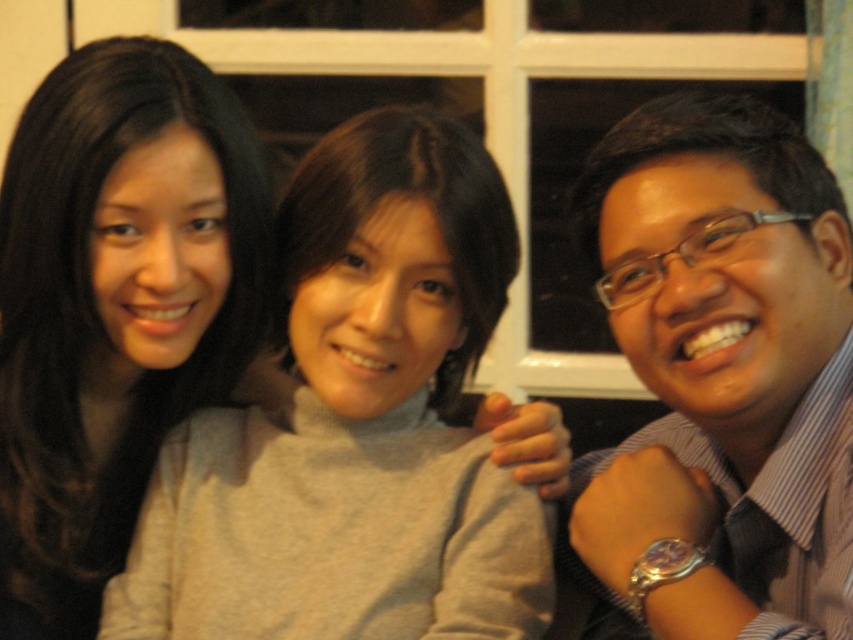
Between point (457, 176) and point (683, 413), which one is positioned in front?

Point (683, 413)

Can you confirm if gray matte sweater at center is shorter than matte black shirt at right?

Indeed, gray matte sweater at center has a lesser height compared to matte black shirt at right.

Does point (364, 116) come behind point (790, 445)?

Yes, point (364, 116) is farther from viewer.

This screenshot has height=640, width=853. What are the coordinates of `gray matte sweater at center` in the screenshot? It's located at (357, 426).

Measure the distance between matte black shirt at right and matte gray sweater at center.

They are 19.72 inches apart.

Is matte black shirt at right positioned before matte gray sweater at center?

Yes, matte black shirt at right is closer to the viewer.

This screenshot has width=853, height=640. Find the location of `matte black shirt at right`. matte black shirt at right is located at coordinates (722, 372).

Who is higher up, gray matte sweater at center or matte gray sweater at center?

matte gray sweater at center is higher up.

Consider the image. Who is more forward, (473,609) or (138,77)?

Point (473,609) is more forward.

Does point (386, 326) lie in front of point (218, 80)?

Yes, it is in front of point (218, 80).

You are a GUI agent. You are given a task and a screenshot of the screen. Output one action in this format:
    pyautogui.click(x=<x>, y=<y>)
    Task: Click on the gray matte sweater at center
    Image resolution: width=853 pixels, height=640 pixels.
    Given the screenshot: What is the action you would take?
    pyautogui.click(x=357, y=426)